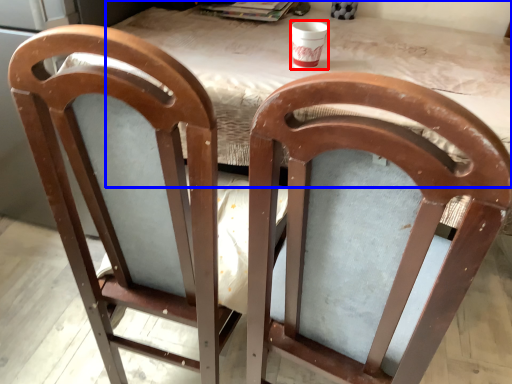
Question: Which object is further to the camera taking this photo, cup (highlighted by a red box) or table (highlighted by a blue box)?

Choices:
 (A) cup
 (B) table

Answer: (A)